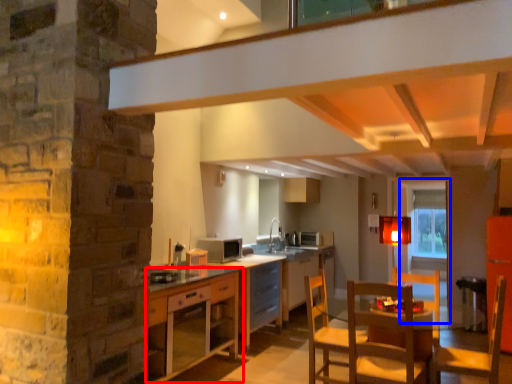
Question: Among these objects, which one is nearest to the camera, cabinetry (highlighted by a red box) or glass door (highlighted by a blue box)?

Choices:
 (A) cabinetry
 (B) glass door

Answer: (A)